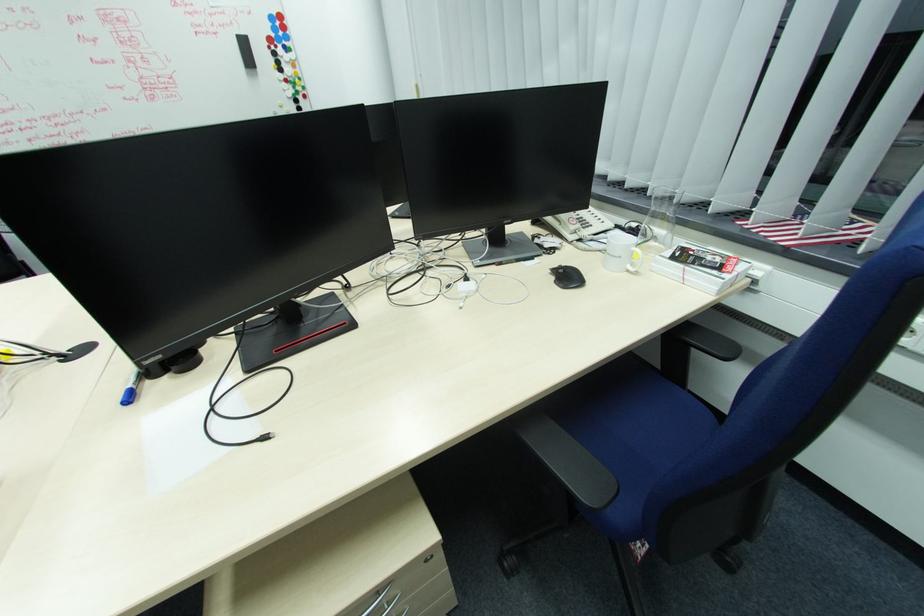
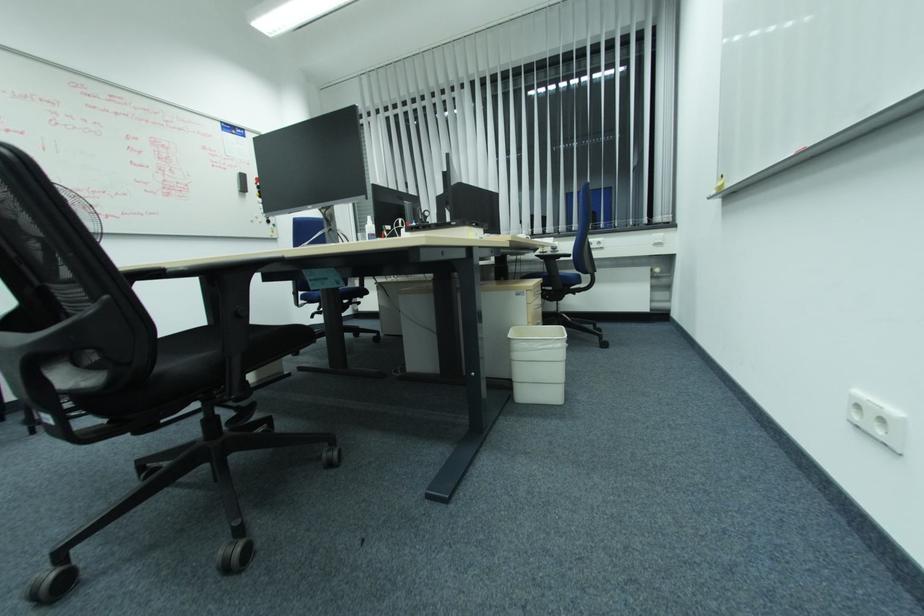
Where in the second image is the point corresponding to (245,44) from the first image?

(244, 177)